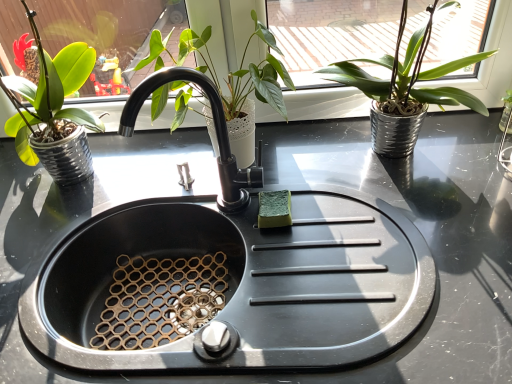
Question: Can you confirm if green matte plant at center, the 2th houseplant positioned from the left, is positioned to the left of green matte plant pot at left, positioned as the first houseplant in left-to-right order?

Choices:
 (A) no
 (B) yes

Answer: (A)

Question: From the image's perspective, is green matte plant at center, the 2th houseplant positioned from the left, over green matte plant pot at left, positioned as the first houseplant in left-to-right order?

Choices:
 (A) no
 (B) yes

Answer: (B)

Question: Is green matte plant at center, the 2th houseplant positioned from the left, positioned with its back to green matte plant pot at left, placed as the 3th houseplant when sorted from right to left?

Choices:
 (A) yes
 (B) no

Answer: (B)

Question: From the image's perspective, does green matte plant at center, the 2th houseplant positioned from the left, appear lower than green matte plant pot at left, positioned as the first houseplant in left-to-right order?

Choices:
 (A) yes
 (B) no

Answer: (B)

Question: Considering the relative sizes of green matte plant at center, the 2th houseplant positioned from the left, and green matte plant pot at left, placed as the 3th houseplant when sorted from right to left, in the image provided, is green matte plant at center, the 2th houseplant positioned from the left, smaller than green matte plant pot at left, placed as the 3th houseplant when sorted from right to left,?

Choices:
 (A) no
 (B) yes

Answer: (B)

Question: From the image's perspective, relative to black matte sink at center, is green matte plant at upper right, marked as the first houseplant in a right-to-left arrangement, above or below?

Choices:
 (A) below
 (B) above

Answer: (B)

Question: Is green matte plant at upper right, acting as the third houseplant starting from the left, inside or outside of black matte sink at center?

Choices:
 (A) outside
 (B) inside

Answer: (A)

Question: Based on their sizes in the image, would you say green matte plant at upper right, marked as the first houseplant in a right-to-left arrangement, is bigger or smaller than black matte sink at center?

Choices:
 (A) big
 (B) small

Answer: (B)

Question: From a real-world perspective, is green matte plant at upper right, acting as the third houseplant starting from the left, positioned above or below black matte sink at center?

Choices:
 (A) above
 (B) below

Answer: (A)

Question: From a real-world perspective, is green matte plant at center, arranged as the second houseplant when viewed from the right, positioned above or below green matte plant at upper right, marked as the first houseplant in a right-to-left arrangement?

Choices:
 (A) above
 (B) below

Answer: (B)

Question: In the image, is green matte plant at center, arranged as the second houseplant when viewed from the right, positioned in front of or behind green matte plant at upper right, marked as the first houseplant in a right-to-left arrangement?

Choices:
 (A) front
 (B) behind

Answer: (B)

Question: Is point (268, 66) closer or farther from the camera than point (422, 94)?

Choices:
 (A) closer
 (B) farther

Answer: (A)

Question: In terms of height, does green matte plant at center, the 2th houseplant positioned from the left, look taller or shorter compared to green matte plant at upper right, marked as the first houseplant in a right-to-left arrangement?

Choices:
 (A) short
 (B) tall

Answer: (A)

Question: From the image's perspective, is black matte faucet at center located above or below green matte plant pot at left, placed as the 3th houseplant when sorted from right to left?

Choices:
 (A) above
 (B) below

Answer: (B)

Question: In the image, is black matte faucet at center positioned in front of or behind green matte plant pot at left, positioned as the first houseplant in left-to-right order?

Choices:
 (A) behind
 (B) front

Answer: (B)